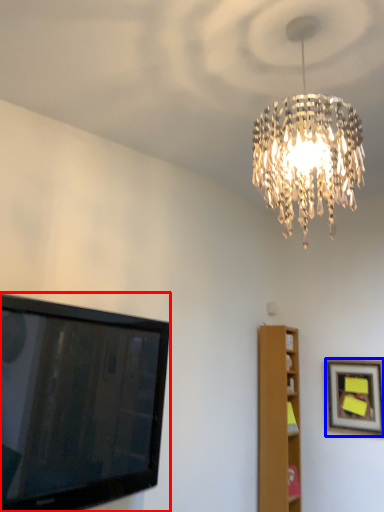
Question: Among these objects, which one is nearest to the camera, television (highlighted by a red box) or picture frame (highlighted by a blue box)?

Choices:
 (A) television
 (B) picture frame

Answer: (A)